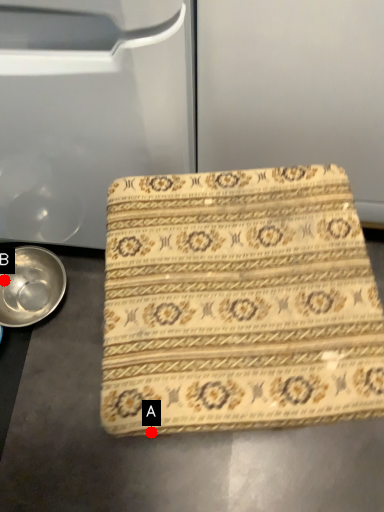
Question: Two points are circled on the image, labeled by A and B beside each circle. Which point is farther to the camera?

Choices:
 (A) A is further
 (B) B is further

Answer: (B)